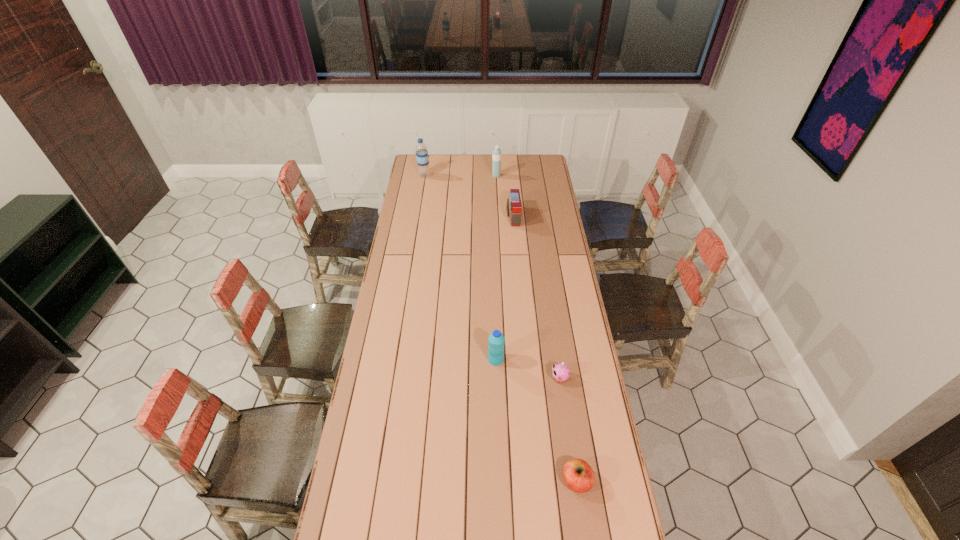
Locate an element on the screen. This screenshot has height=540, width=960. the leftmost water bottle is located at coordinates click(x=422, y=158).

You are a GUI agent. You are given a task and a screenshot of the screen. Output one action in this format:
    pyautogui.click(x=<x>, y=<y>)
    Task: Click on the leftmost object
    Image resolution: width=960 pixels, height=540 pixels.
    Given the screenshot: What is the action you would take?
    pyautogui.click(x=422, y=158)

Find the location of a particular element. This screenshot has width=960, height=540. the nearest water bottle is located at coordinates (496, 340).

I want to click on the fourth shortest object, so click(496, 340).

I want to click on the third farthest object, so click(513, 207).

This screenshot has width=960, height=540. I want to click on camera, so click(x=513, y=207).

The image size is (960, 540). Find the location of `cupcake`. cupcake is located at coordinates (560, 371).

You are a GUI agent. You are given a task and a screenshot of the screen. Output one action in this format:
    pyautogui.click(x=<x>, y=<y>)
    Task: Click on the apple
    The image size is (960, 540).
    Given the screenshot: What is the action you would take?
    pyautogui.click(x=578, y=475)

The height and width of the screenshot is (540, 960). Identify the location of vacant space located 0.300m on the label of the leftmost water bottle. (480, 175).

In order to click on free spot located on the left of the nearest water bottle in this screenshot , I will do `click(445, 360)`.